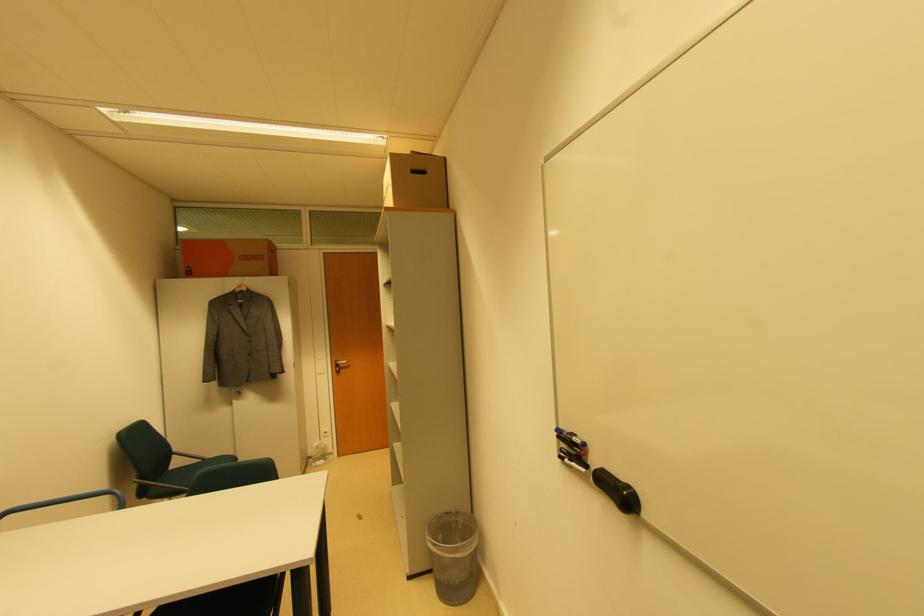
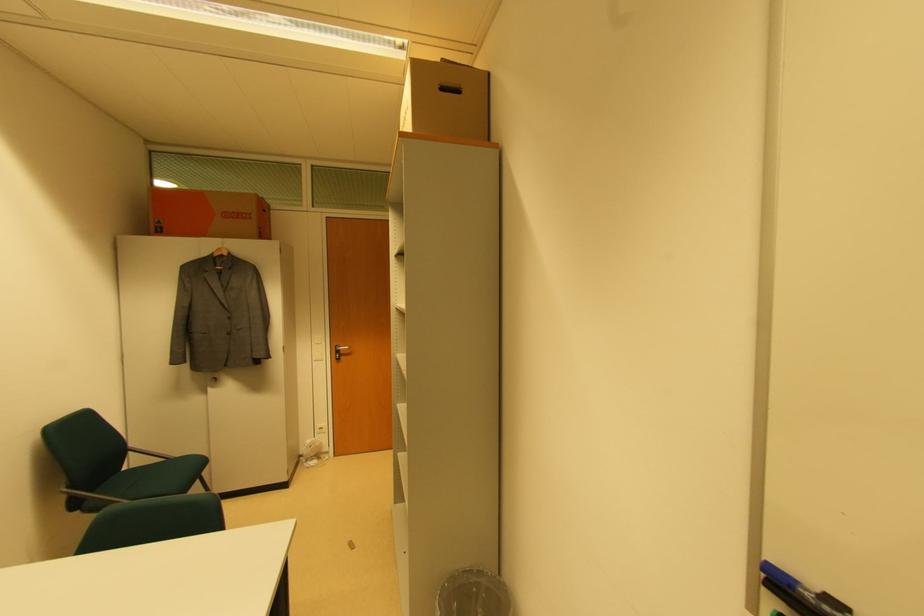
Question: The images are taken continuously from a first-person perspective. In which direction are you moving?

Choices:
 (A) Left
 (B) Right
 (C) Forward
 (D) Backward

Answer: (C)